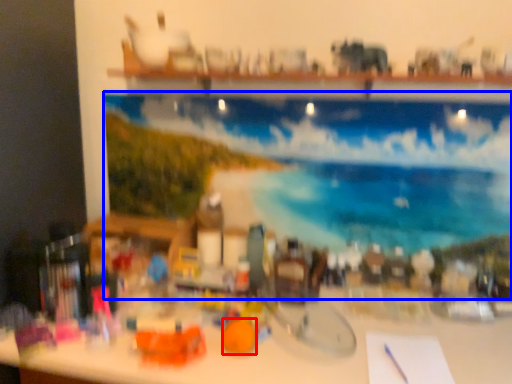
Question: Which of the following is the closest to the observer, toy (highlighted by a red box) or swimming pool (highlighted by a blue box)?

Choices:
 (A) toy
 (B) swimming pool

Answer: (A)